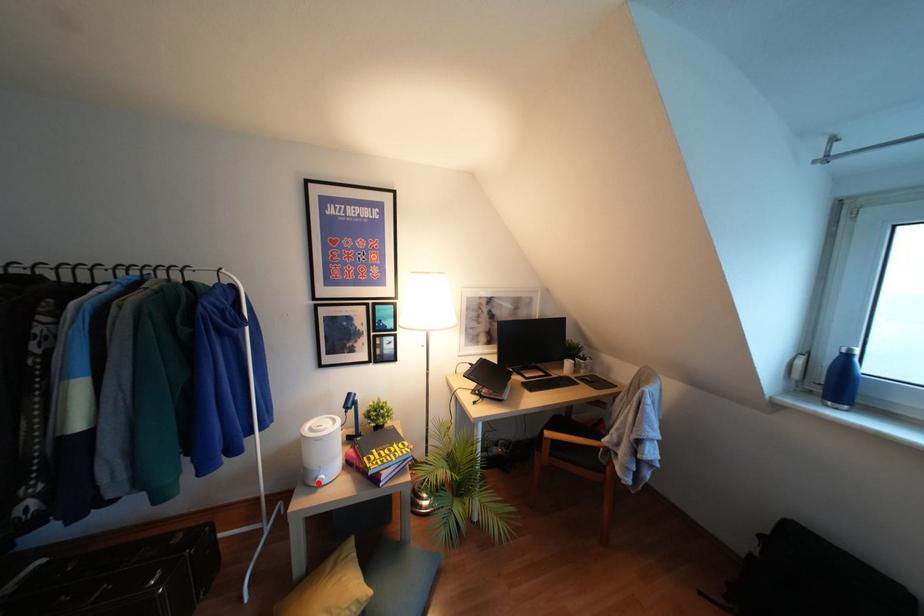
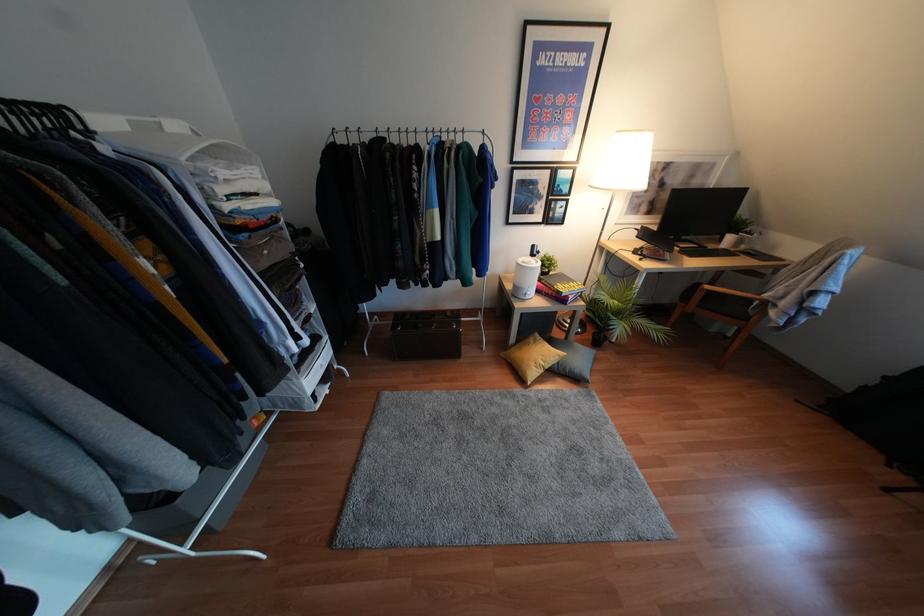
Locate, in the second image, the point that corresponds to the highlighted location in the first image.

(526, 297)